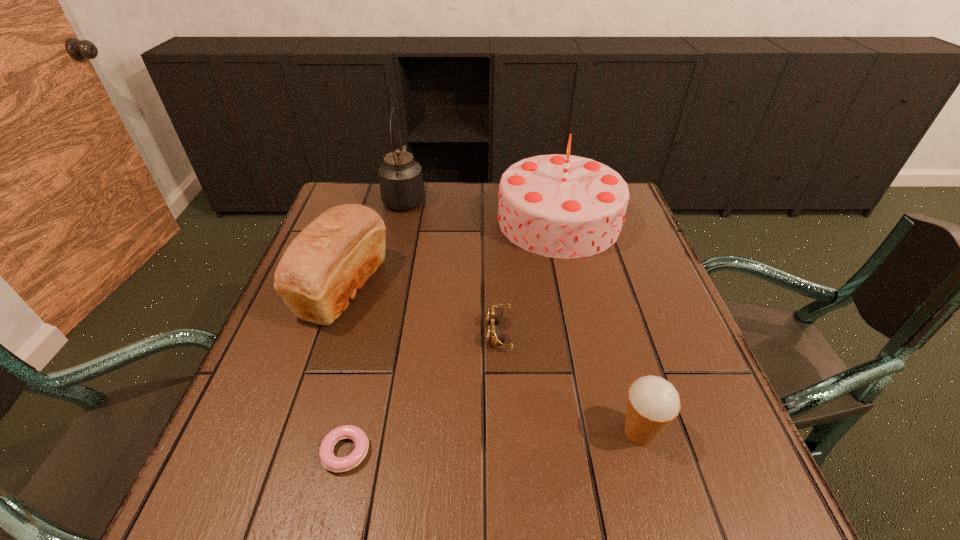
This screenshot has height=540, width=960. Find the location of `vacant area that satisfies the following two spatial constraints: 1. through the lenses of the goggles; 2. on the left side of the third shortest object`. vacant area that satisfies the following two spatial constraints: 1. through the lenses of the goggles; 2. on the left side of the third shortest object is located at coordinates (503, 432).